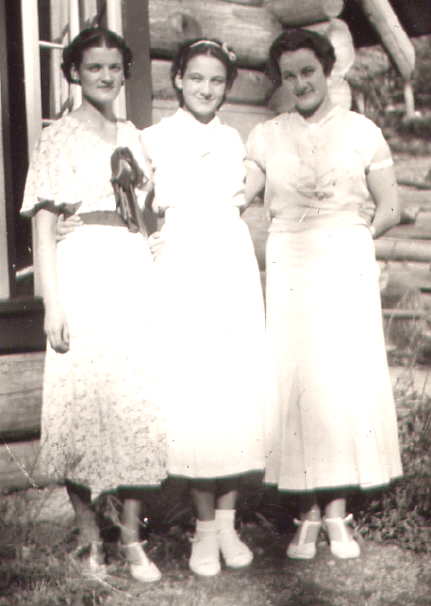
The height and width of the screenshot is (606, 431). I want to click on window frame, so click(37, 53).